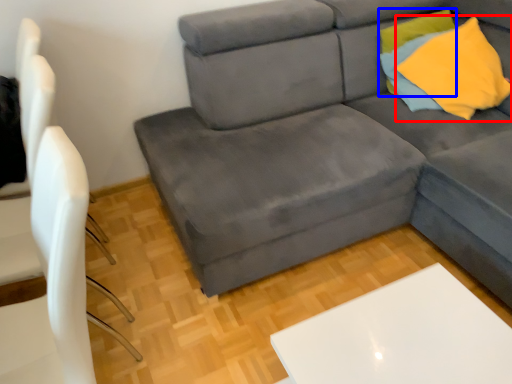
Question: Which point is closer to the camera, throw pillow (highlighted by a red box) or pillow (highlighted by a blue box)?

Choices:
 (A) throw pillow
 (B) pillow

Answer: (A)